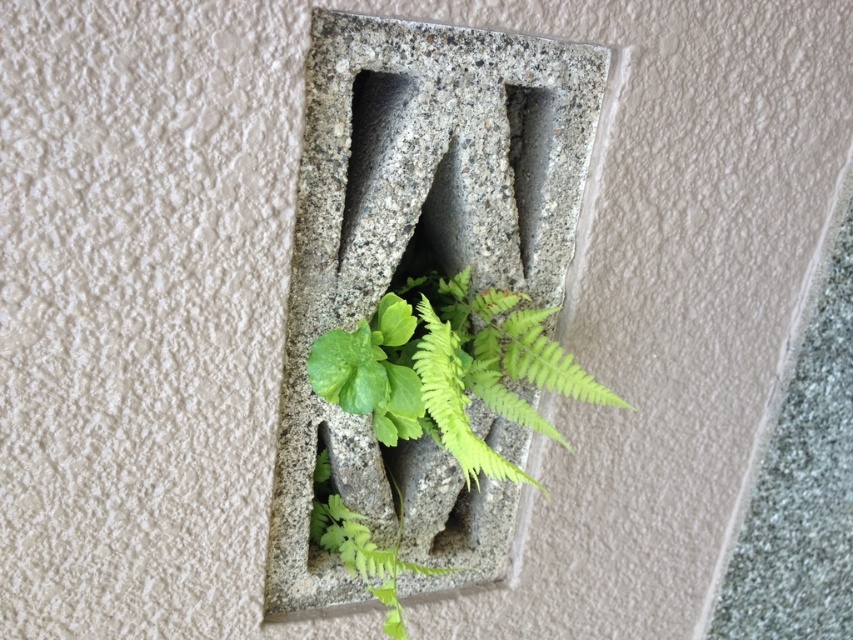
Question: Among these points, which one is farthest from the camera?

Choices:
 (A) (397, 308)
 (B) (399, 48)

Answer: (A)

Question: Which point is closer to the camera?

Choices:
 (A) granite stone at center
 (B) green leafy plant at center

Answer: (A)

Question: Which point is closer to the camera taking this photo?

Choices:
 (A) (332, 376)
 (B) (370, 122)

Answer: (A)

Question: Is granite stone at center to the right of green leafy plant at center from the viewer's perspective?

Choices:
 (A) no
 (B) yes

Answer: (A)

Question: Is granite stone at center above green leafy plant at center?

Choices:
 (A) yes
 (B) no

Answer: (A)

Question: Is granite stone at center smaller than green leafy plant at center?

Choices:
 (A) no
 (B) yes

Answer: (A)